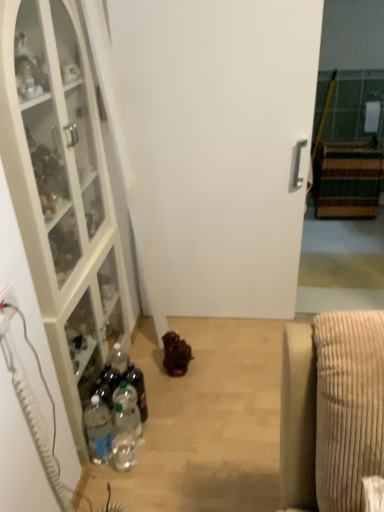
Where is `unoccupied area in front of white matte door at center`? unoccupied area in front of white matte door at center is located at coordinates (224, 365).